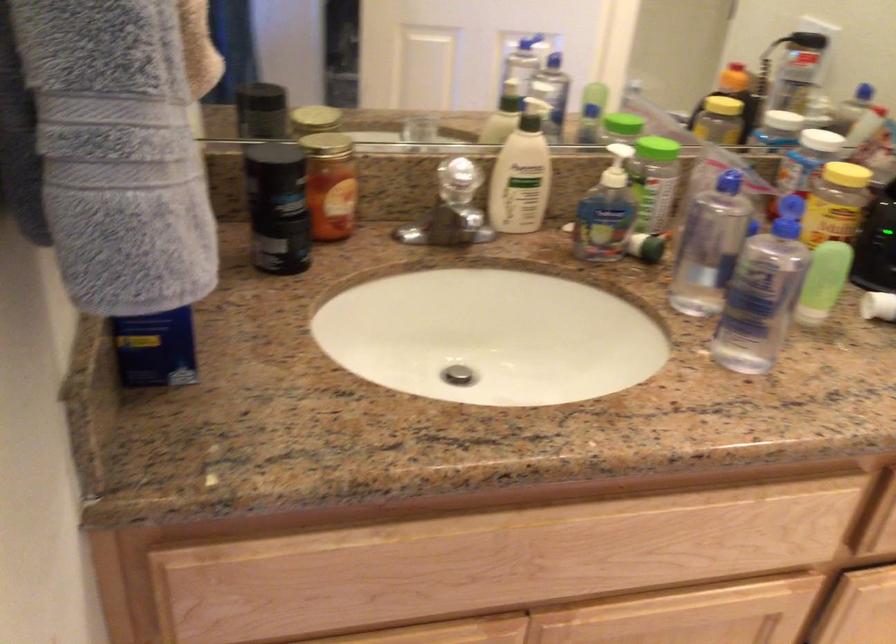
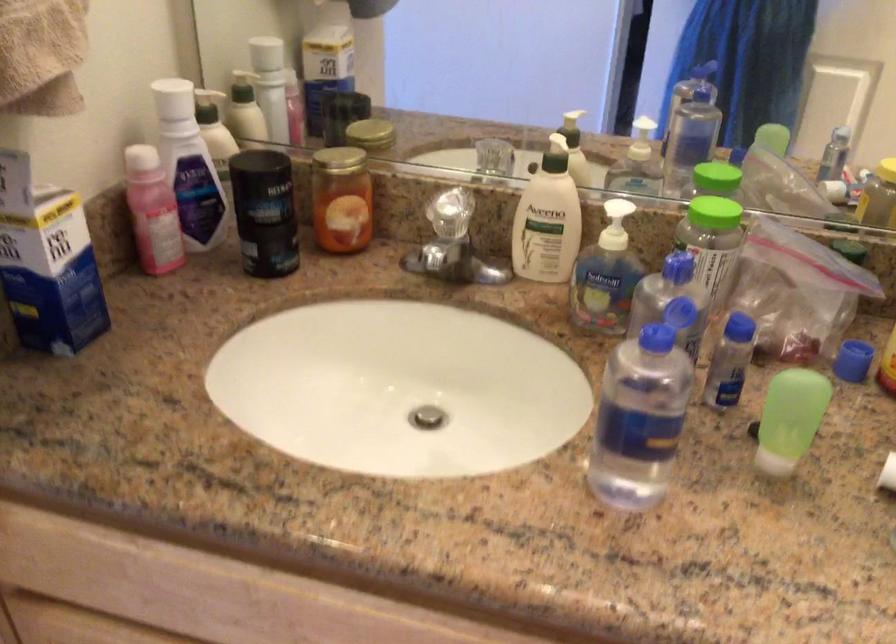
Locate, in the second image, the point that corresponds to point 298,203 in the first image.

(264, 212)